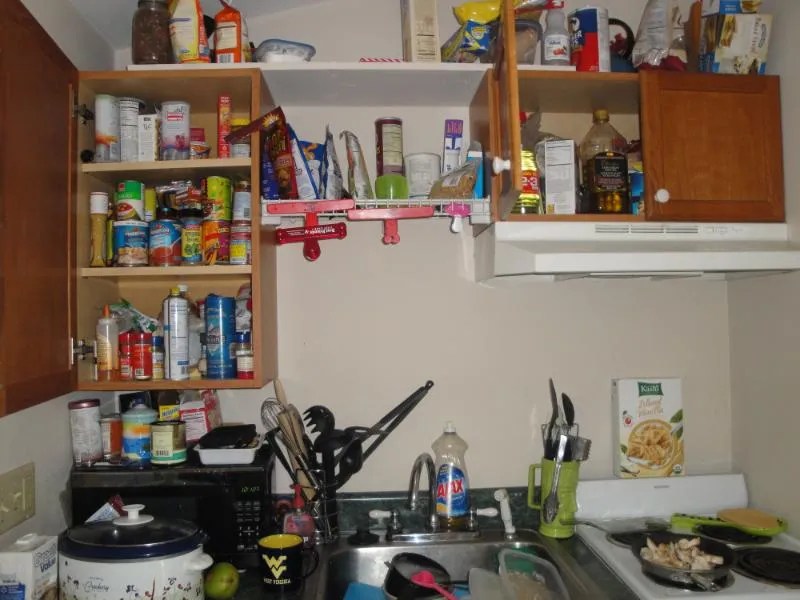
Where is `cabinets`? Image resolution: width=800 pixels, height=600 pixels. cabinets is located at coordinates (154, 207), (628, 172).